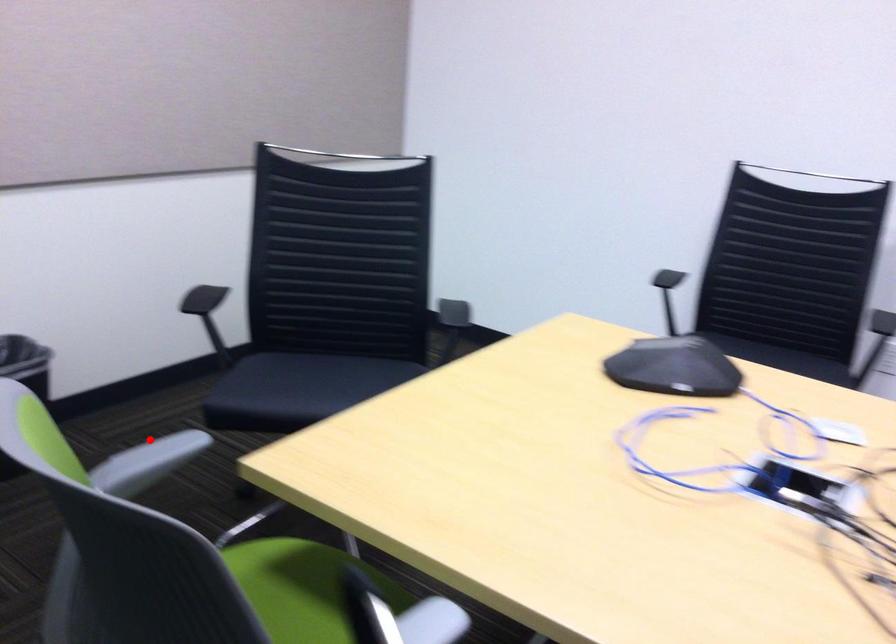
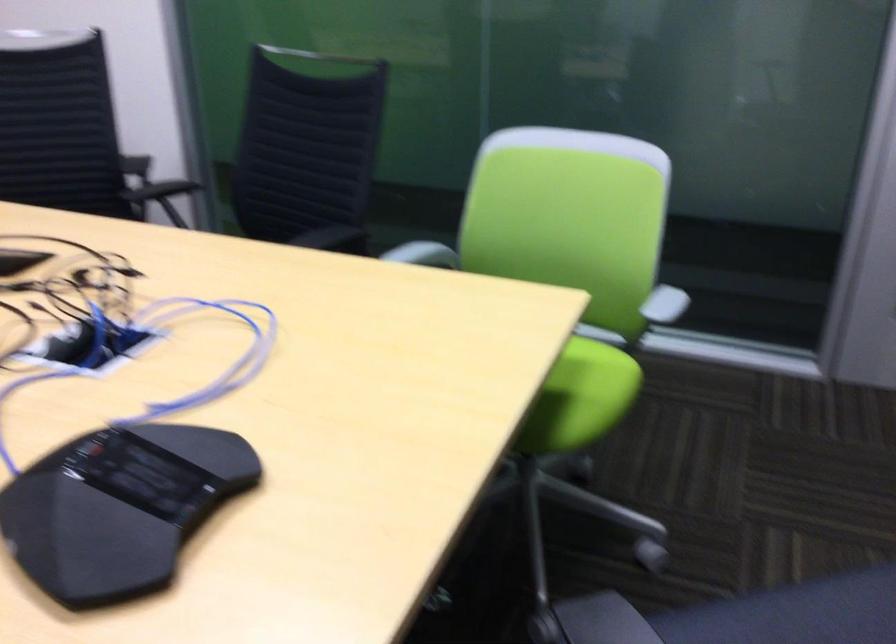
Find the pixel in the second image that matches the highlighted location in the first image.

(659, 310)